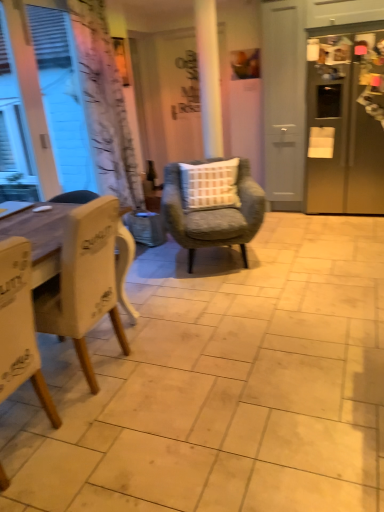
You are a GUI agent. You are given a task and a screenshot of the screen. Output one action in this format:
    pyautogui.click(x=<x>, y=<y>)
    Task: Click on the free space on the front side of white wood chair at left, the second chair when ordered from front to back
    Image resolution: width=384 pixels, height=512 pixels.
    Given the screenshot: What is the action you would take?
    pyautogui.click(x=107, y=436)